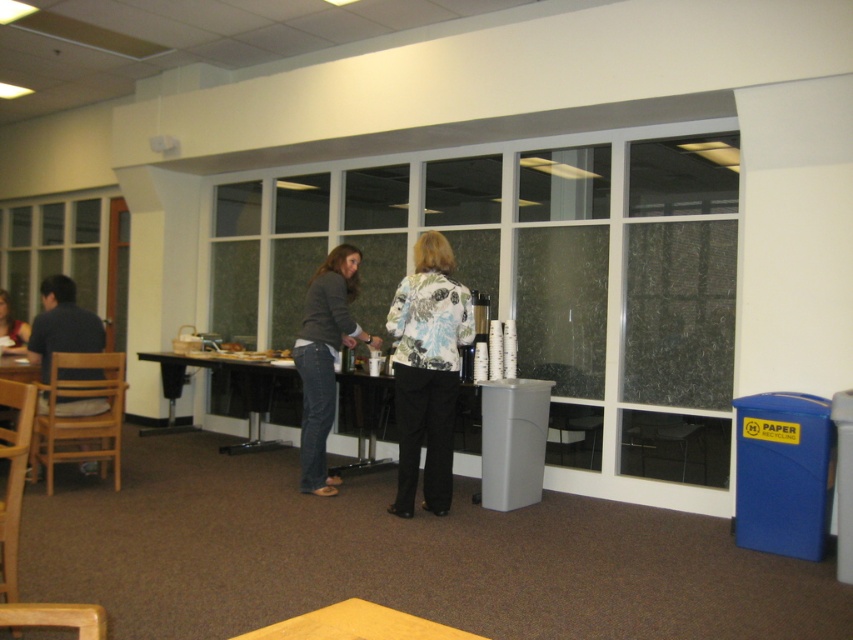
Is denim jeans at center positioned in front of dark blue shirt at left?

No, it is not.

Can you confirm if denim jeans at center is positioned to the right of dark blue shirt at left?

Yes, denim jeans at center is to the right of dark blue shirt at left.

This screenshot has width=853, height=640. What are the coordinates of `denim jeans at center` in the screenshot? It's located at click(325, 358).

Does denim jeans at center appear on the left side of black laminate table at center?

In fact, denim jeans at center is to the right of black laminate table at center.

Which is in front, point (352, 294) or point (277, 444)?

Point (352, 294) is in front.

Who is more distant from viewer, (308, 381) or (202, 376)?

Point (202, 376)

Identify the location of denim jeans at center. (325, 358).

The width and height of the screenshot is (853, 640). What do you see at coordinates (427, 371) in the screenshot?
I see `floral-patterned jacket at center` at bounding box center [427, 371].

Which is in front, point (468, 333) or point (413, 492)?

Positioned in front is point (413, 492).

Locate an element on the screen. Image resolution: width=853 pixels, height=640 pixels. floral-patterned jacket at center is located at coordinates (427, 371).